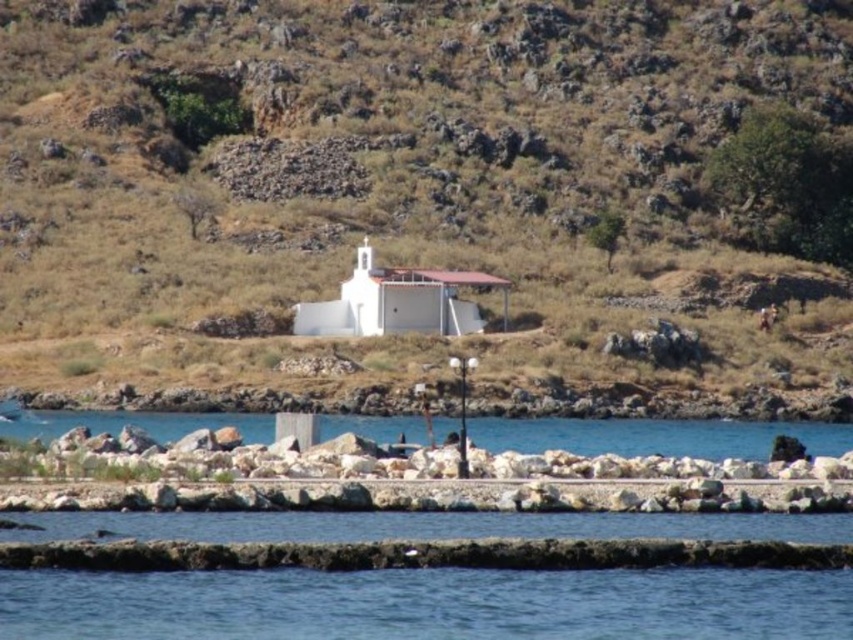
You are standing at the point with coordinates point (x=508, y=284) and want to walk towards the point (x=149, y=429). Based on the scene description, which direction should you face to move towards your destination?

You should face forward because point (x=149, y=429) is in front of point (x=508, y=284).

You are planning to build a small garden on the smooth rock hillside at center and the white matte church at center. Which location would allow for a larger garden area?

The smooth rock hillside at center has a larger size compared to the white matte church at center, so it can accommodate a larger garden area.